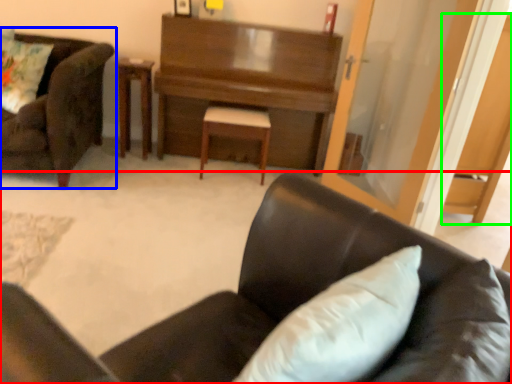
Question: Which object is the closest to the chair (highlighted by a red box)? Choose among these: chair (highlighted by a blue box) or dark (highlighted by a green box).

Choices:
 (A) chair
 (B) dark

Answer: (A)